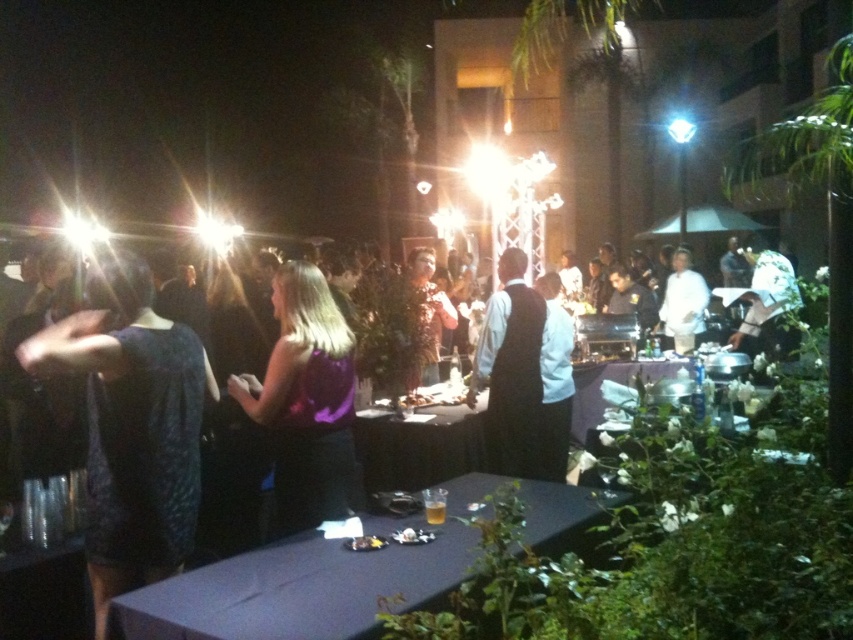
You are a guest at this event and need to move from the black satin vest at center to the white chef coat at center to ask about the menu. Can you walk directly between them without needing to go around any obstacles?

The distance between the black satin vest at center and the white chef coat at center is 3.11 meters, so yes, you can walk directly between them as there is enough space.